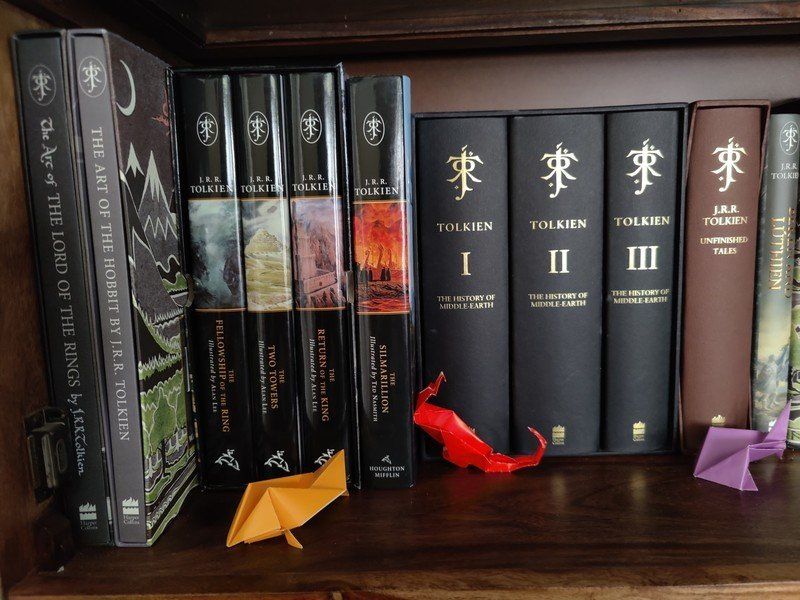
The width and height of the screenshot is (800, 600). I want to click on dark grey spine on books, so click(450, 350), click(565, 348), click(630, 353).